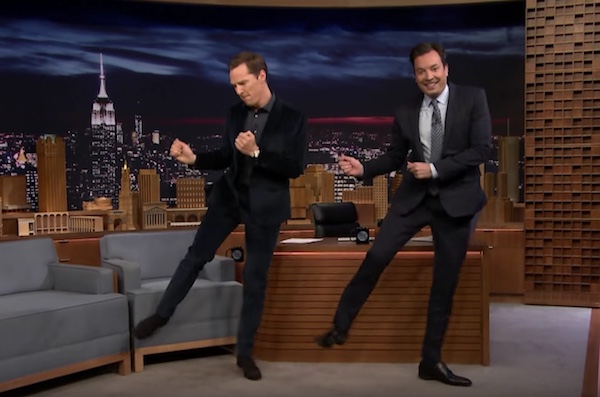
At what (x,y) coordinates should I click in order to perform the action: click on gray chair. Please return your answer as a coordinate pair (x, y). Looking at the image, I should click on (151, 253).